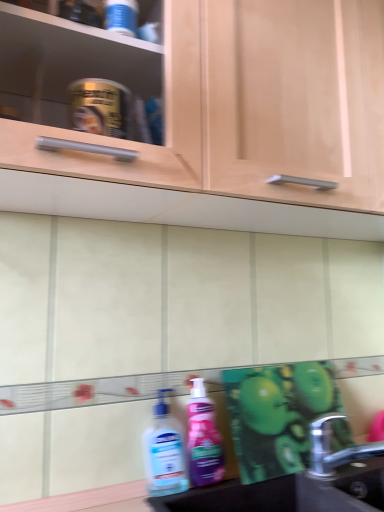
Question: From a real-world perspective, is matte wood cabinet at upper center above or below pink glossy lotion at lower center, marked as the first cleaning product in a right-to-left arrangement?

Choices:
 (A) above
 (B) below

Answer: (A)

Question: In the image, is matte wood cabinet at upper center positioned in front of or behind pink glossy lotion at lower center, which is counted as the second cleaning product, starting from the left?

Choices:
 (A) front
 (B) behind

Answer: (A)

Question: Which is farther from the matte wood cabinet at upper center?

Choices:
 (A) silver metallic faucet at lower right
 (B) pink glossy lotion at lower center, which is counted as the second cleaning product, starting from the left
 (C) black matte sink at lower right
 (D) translucent plastic hand sanitizer at lower center, which ranks as the 2th cleaning product in right-to-left order

Answer: (A)

Question: Which object is positioned closest to the silver metallic faucet at lower right?

Choices:
 (A) black matte sink at lower right
 (B) matte wood cabinet at upper center
 (C) translucent plastic hand sanitizer at lower center, arranged as the first cleaning product when viewed from the left
 (D) pink glossy lotion at lower center, which is counted as the second cleaning product, starting from the left

Answer: (A)